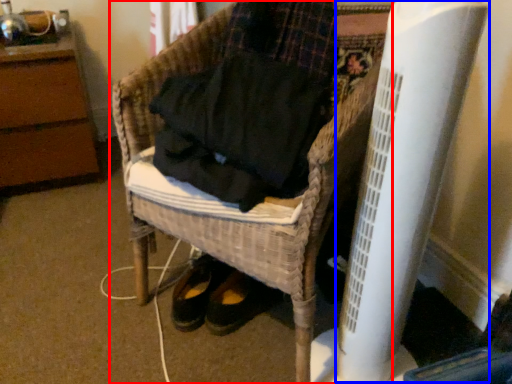
Question: Which point is closer to the camera, furniture (highlighted by a red box) or radiator (highlighted by a blue box)?

Choices:
 (A) furniture
 (B) radiator

Answer: (B)